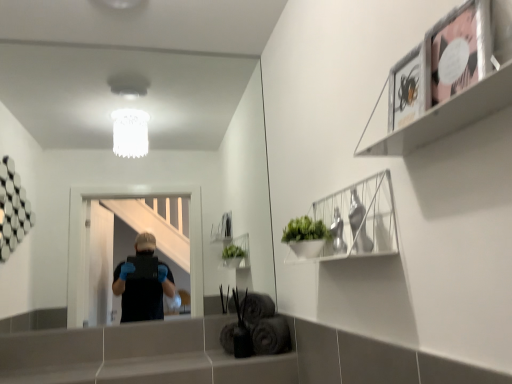
Describe the element at coordinates (137, 356) in the screenshot. I see `smooth gray ledge at lower center` at that location.

Identify the location of metallic silver frame at upper right. (448, 80).

Is matte black picture frame at upper right not near metallic silver frame at upper right?

No, matte black picture frame at upper right is not far away from metallic silver frame at upper right.

Is matte black picture frame at upper right positioned beyond the bounds of metallic silver frame at upper right?

No.

Consider the image. Can you tell me how much matte black picture frame at upper right and metallic silver frame at upper right differ in facing direction?

There is a 0.251-degree angle between the facing directions of matte black picture frame at upper right and metallic silver frame at upper right.

Between point (392, 72) and point (426, 40), which one is positioned in front?

The point (426, 40) is closer to the camera.

Which is further, [394,231] or [403,124]?

The point [394,231] is behind.

Locate an element on the screen. cabinet located below the matte black picture frame at upper right (from the image's perspective) is located at coordinates (357, 220).

Is white wire basket at upper right smaller than matte black picture frame at upper right?

Incorrect, white wire basket at upper right is not smaller in size than matte black picture frame at upper right.

Which object is wider, white wire basket at upper right or matte black picture frame at upper right?

white wire basket at upper right is wider.

Between metallic silver frame at upper right and white wire basket at upper right, which one has less height?

white wire basket at upper right.

Consider the image. Considering the sizes of metallic silver frame at upper right and white wire basket at upper right in the image, is metallic silver frame at upper right wider or thinner than white wire basket at upper right?

Clearly, metallic silver frame at upper right has less width compared to white wire basket at upper right.

Does metallic silver frame at upper right have a smaller size compared to white wire basket at upper right?

Indeed, metallic silver frame at upper right has a smaller size compared to white wire basket at upper right.

From a real-world perspective, does metallic silver frame at upper right sit lower than white wire basket at upper right?

No, from a real-world perspective, metallic silver frame at upper right is not beneath white wire basket at upper right.

Which point is more forward, [385,246] or [27,345]?

The point [385,246] is closer.

Which is in front, white wire basket at upper right or smooth gray ledge at lower center?

white wire basket at upper right is closer to the camera.

Where is `cabinet lying in front of the smooth gray ledge at lower center`? Image resolution: width=512 pixels, height=384 pixels. cabinet lying in front of the smooth gray ledge at lower center is located at coordinates (357, 220).

Which of these two, white wire basket at upper right or smooth gray ledge at lower center, stands shorter?

With less height is smooth gray ledge at lower center.

In terms of height, does smooth gray ledge at lower center look taller or shorter compared to metallic silver frame at upper right?

In the image, smooth gray ledge at lower center appears to be shorter than metallic silver frame at upper right.

From a real-world perspective, relative to metallic silver frame at upper right, is smooth gray ledge at lower center vertically above or below?

In terms of real-world spatial position, smooth gray ledge at lower center is below metallic silver frame at upper right.

Which object is closer to the camera taking this photo, smooth gray ledge at lower center or metallic silver frame at upper right?

metallic silver frame at upper right.

Is smooth gray ledge at lower center to the left of metallic silver frame at upper right from the viewer's perspective?

Yes.

From the image's perspective, is smooth gray ledge at lower center above matte black picture frame at upper right?

Incorrect, from the image's perspective, smooth gray ledge at lower center is lower than matte black picture frame at upper right.

Would you say smooth gray ledge at lower center is to the left or to the right of matte black picture frame at upper right in the picture?

In the image, smooth gray ledge at lower center appears on the left side of matte black picture frame at upper right.

Does smooth gray ledge at lower center have a smaller size compared to matte black picture frame at upper right?

Actually, smooth gray ledge at lower center might be larger than matte black picture frame at upper right.

Can you see smooth gray ledge at lower center touching matte black picture frame at upper right?

No, smooth gray ledge at lower center is not with matte black picture frame at upper right.

Consider the image. Is matte black picture frame at upper right smaller than white wire basket at upper right?

Yes.

From the image's perspective, is matte black picture frame at upper right on top of white wire basket at upper right?

Correct, matte black picture frame at upper right appears higher than white wire basket at upper right in the image.

Is matte black picture frame at upper right at the right side of white wire basket at upper right?

Correct, you'll find matte black picture frame at upper right to the right of white wire basket at upper right.

You are a GUI agent. You are given a task and a screenshot of the screen. Output one action in this format:
    pyautogui.click(x=<x>, y=<y>)
    Task: Click on the shelf above the matte black picture frame at upper right (from a real-world perspective)
    
    Given the screenshot: What is the action you would take?
    pyautogui.click(x=448, y=80)

I want to click on picture frame lying above the white wire basket at upper right (from the image's perspective), so click(406, 89).

Considering their positions, is matte black picture frame at upper right positioned closer to metallic silver frame at upper right than smooth gray ledge at lower center?

Answer: matte black picture frame at upper right is closer to metallic silver frame at upper right.

Consider the image. Which object lies nearer to the anchor point white wire basket at upper right, smooth gray ledge at lower center or metallic silver frame at upper right?

metallic silver frame at upper right.

Considering their positions, is white wire basket at upper right positioned further to matte black picture frame at upper right than metallic silver frame at upper right?

Based on the image, white wire basket at upper right appears to be further to matte black picture frame at upper right.

Looking at the image, which one is located further to smooth gray ledge at lower center, metallic silver frame at upper right or matte black picture frame at upper right?

matte black picture frame at upper right is positioned further to the anchor smooth gray ledge at lower center.

From the image, which object appears to be nearer to matte black picture frame at upper right, metallic silver frame at upper right or white wire basket at upper right?

Based on the image, metallic silver frame at upper right appears to be nearer to matte black picture frame at upper right.

Based on their spatial positions, is smooth gray ledge at lower center or metallic silver frame at upper right closer to matte black picture frame at upper right?

Based on the image, metallic silver frame at upper right appears to be nearer to matte black picture frame at upper right.

When comparing their distances from metallic silver frame at upper right, does white wire basket at upper right or smooth gray ledge at lower center seem further?

Among the two, smooth gray ledge at lower center is located further to metallic silver frame at upper right.

Based on their spatial positions, is metallic silver frame at upper right or smooth gray ledge at lower center closer to matte black picture frame at upper right?

The object closer to matte black picture frame at upper right is metallic silver frame at upper right.

This screenshot has width=512, height=384. I want to click on picture frame between metallic silver frame at upper right and smooth gray ledge at lower center vertically, so click(406, 89).

You are a GUI agent. You are given a task and a screenshot of the screen. Output one action in this format:
    pyautogui.click(x=<x>, y=<y>)
    Task: Click on the cabinet between metallic silver frame at upper right and smooth gray ledge at lower center vertically
    
    Given the screenshot: What is the action you would take?
    pyautogui.click(x=357, y=220)

Where is `cabinet between matte black picture frame at upper right and smooth gray ledge at lower center from top to bottom`? cabinet between matte black picture frame at upper right and smooth gray ledge at lower center from top to bottom is located at coordinates (357, 220).

Where is `picture frame between metallic silver frame at upper right and white wire basket at upper right along the z-axis`? picture frame between metallic silver frame at upper right and white wire basket at upper right along the z-axis is located at coordinates (406, 89).